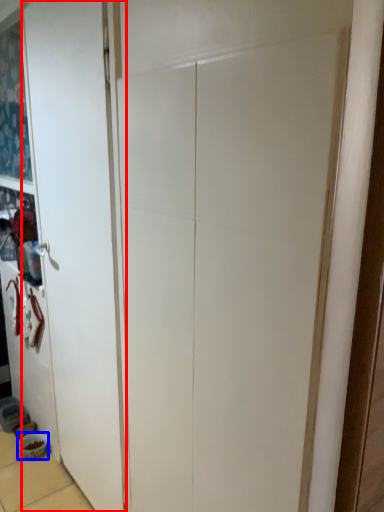
Question: Which object appears closest to the camera in this image, door (highlighted by a red box) or bowl (highlighted by a blue box)?

Choices:
 (A) door
 (B) bowl

Answer: (A)